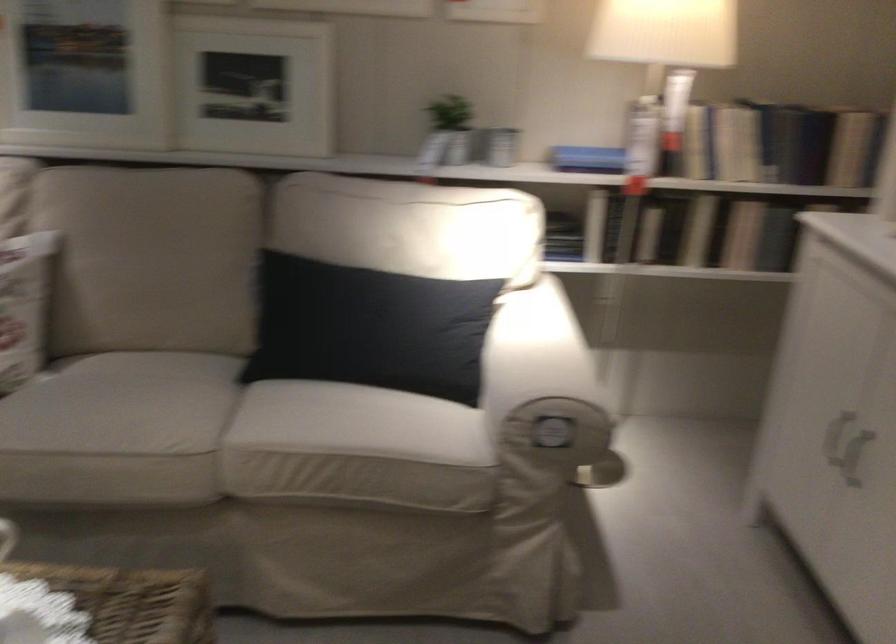
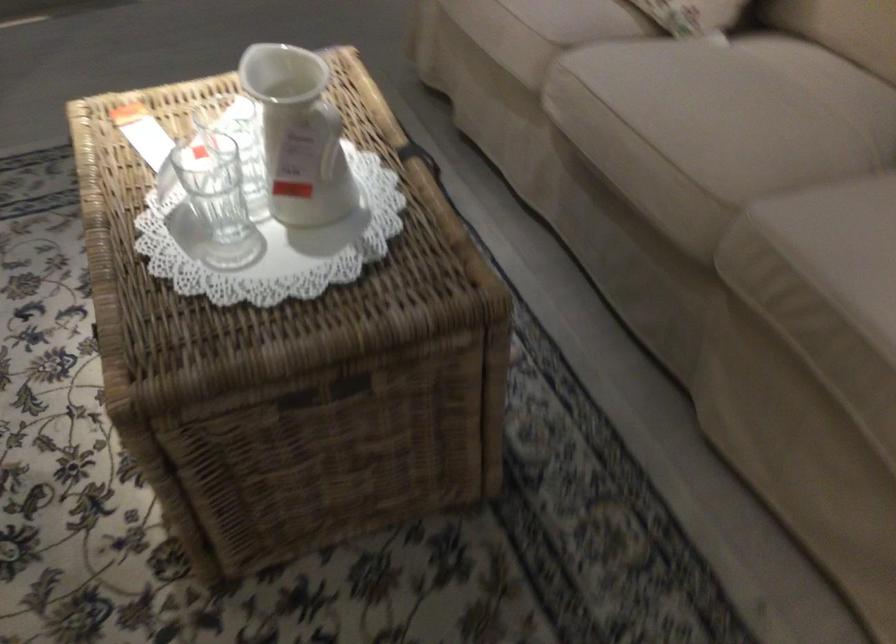
Locate, in the second image, the point that corresponds to point (168, 446) in the first image.

(704, 167)